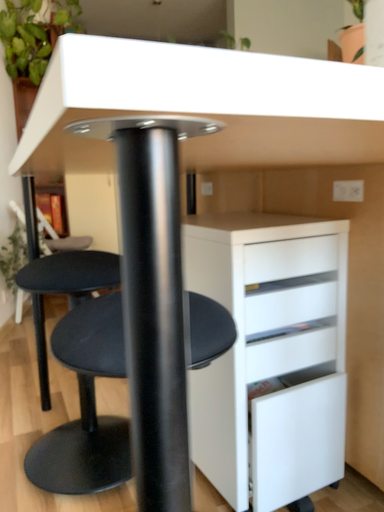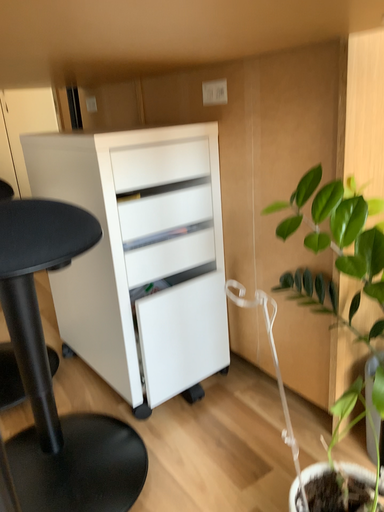
Question: How did the camera likely rotate when shooting the video?

Choices:
 (A) rotated right
 (B) rotated left

Answer: (A)